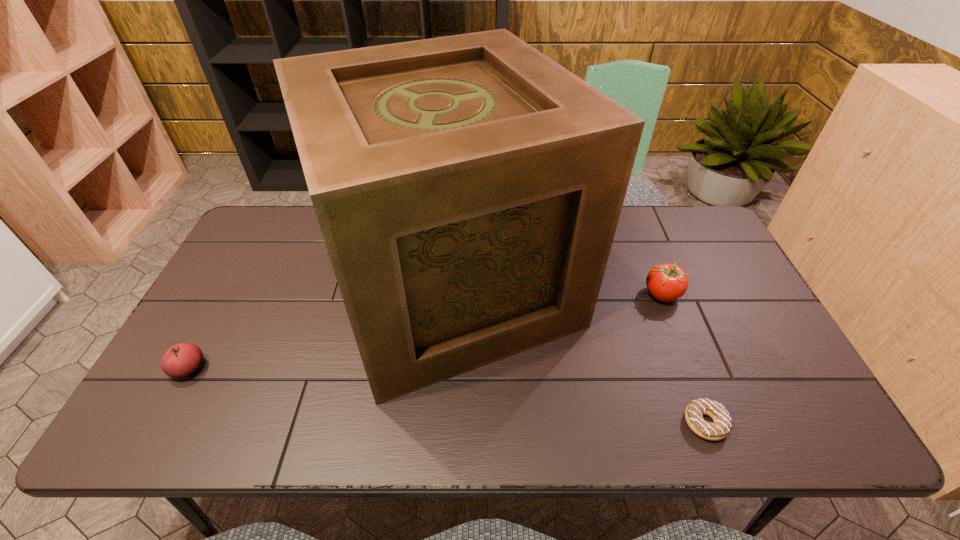
Locate an element on the screen. This screenshot has height=540, width=960. the third object from right to left is located at coordinates (468, 188).

The width and height of the screenshot is (960, 540). I want to click on box, so click(468, 188).

The image size is (960, 540). Find the location of `the second tallest object`. the second tallest object is located at coordinates coord(666,282).

The height and width of the screenshot is (540, 960). In order to click on the farther tomato in this screenshot , I will do `click(666, 282)`.

Where is `the leftmost object`? The height and width of the screenshot is (540, 960). the leftmost object is located at coordinates (180, 360).

Where is `the nearer tomato`? This screenshot has height=540, width=960. the nearer tomato is located at coordinates (180, 360).

Image resolution: width=960 pixels, height=540 pixels. In order to click on doughnut in this screenshot , I will do `click(694, 412)`.

The image size is (960, 540). In order to click on vacant region located on the left of the second object from left to right in this screenshot , I will do `click(251, 286)`.

Where is `free space located 0.140m on the back of the second tallest object`? The image size is (960, 540). free space located 0.140m on the back of the second tallest object is located at coordinates (644, 249).

Identify the location of vacant region located 0.230m on the right of the leftmost object. This screenshot has width=960, height=540. (300, 368).